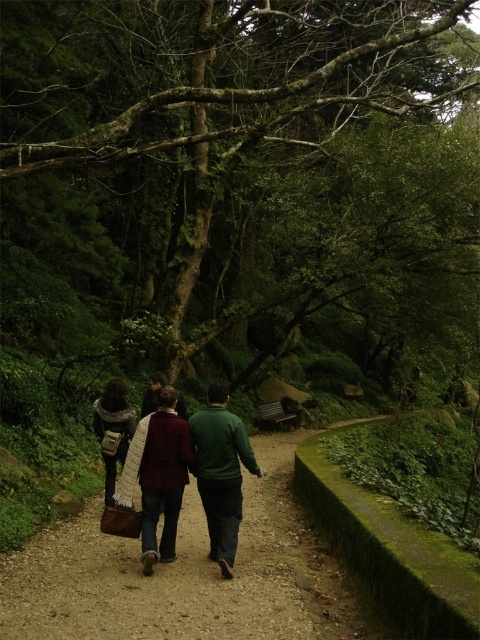
Who is shorter, brown gravel path at center or green matte jacket at center?

brown gravel path at center

What do you see at coordinates (186, 576) in the screenshot? The width and height of the screenshot is (480, 640). I see `brown gravel path at center` at bounding box center [186, 576].

Find the location of a particular element. The image size is (480, 640). brown gravel path at center is located at coordinates (186, 576).

Can you confirm if green leafy tree at center is shorter than brown gravel path at center?

In fact, green leafy tree at center may be taller than brown gravel path at center.

Between point (321, 253) and point (348, 625), which one is positioned in front?

Point (348, 625) is more forward.

Locate an element on the screen. This screenshot has height=640, width=480. green leafy tree at center is located at coordinates (236, 172).

Can you confirm if green matte sweater at center is thinner than green matte jacket at center?

No, green matte sweater at center is not thinner than green matte jacket at center.

Does point (229, 428) lie in front of point (143, 412)?

Yes, it is.

Measure the distance between point (212,497) and camera.

Point (212,497) and camera are 6.01 meters apart from each other.

The image size is (480, 640). I want to click on green matte sweater at center, so click(220, 472).